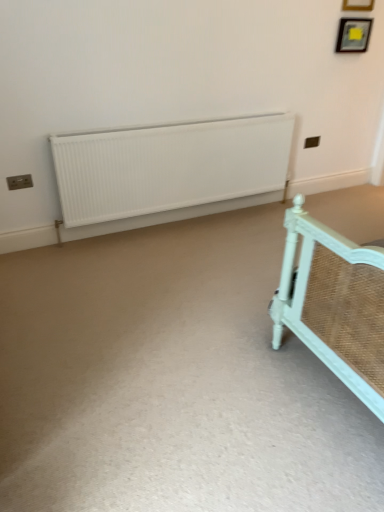
What is the approximate height of white matte radiator at center?

white matte radiator at center is 30.09 inches in height.

Where is `wooden picture frame at upper right, which is the 1th picture frame in bottom-to-top order`? The image size is (384, 512). wooden picture frame at upper right, which is the 1th picture frame in bottom-to-top order is located at coordinates (353, 35).

This screenshot has height=512, width=384. Identify the location of white matte radiator at center. pos(169,166).

Which is closer, (361, 34) or (221, 132)?

The point (221, 132) is closer to the camera.

From a real-world perspective, relative to white matte radiator at center, is wooden picture frame at upper right, acting as the 2th picture frame starting from the top, vertically above or below?

wooden picture frame at upper right, acting as the 2th picture frame starting from the top, is situated higher than white matte radiator at center in the real world.

Does wooden picture frame at upper right, acting as the 2th picture frame starting from the top, have a smaller size compared to white matte radiator at center?

Indeed, wooden picture frame at upper right, acting as the 2th picture frame starting from the top, has a smaller size compared to white matte radiator at center.

Considering the sizes of objects wooden picture frame at upper right, which is the 1th picture frame in bottom-to-top order, and white matte radiator at center in the image provided, who is wider, wooden picture frame at upper right, which is the 1th picture frame in bottom-to-top order, or white matte radiator at center?

Wider between the two is white matte radiator at center.

From the image's perspective, is white matte radiator at center positioned above or below wooden picture frame at upper right, the second picture frame in the bottom-to-top sequence?

Based on their image positions, white matte radiator at center is located beneath wooden picture frame at upper right, the second picture frame in the bottom-to-top sequence.

What's the angular difference between white matte radiator at center and wooden picture frame at upper right, the first picture frame when ordered from top to bottom,'s facing directions?

The angular difference between white matte radiator at center and wooden picture frame at upper right, the first picture frame when ordered from top to bottom, is 0.312 degrees.

Looking at this image, is white matte radiator at center facing towards wooden picture frame at upper right, the first picture frame when ordered from top to bottom?

No, white matte radiator at center is not oriented towards wooden picture frame at upper right, the first picture frame when ordered from top to bottom.

From a real-world perspective, is white matte radiator at center positioned above or below wooden picture frame at upper right, the second picture frame in the bottom-to-top sequence?

From a real-world perspective, white matte radiator at center is physically below wooden picture frame at upper right, the second picture frame in the bottom-to-top sequence.

In terms of width, does wooden picture frame at upper right, the second picture frame in the bottom-to-top sequence, look wider or thinner when compared to white matte radiator at center?

wooden picture frame at upper right, the second picture frame in the bottom-to-top sequence, is thinner than white matte radiator at center.

Is the position of wooden picture frame at upper right, the first picture frame when ordered from top to bottom, less distant than that of white matte radiator at center?

That is False.

Can you tell me how much wooden picture frame at upper right, the second picture frame in the bottom-to-top sequence, and white matte radiator at center differ in facing direction?

wooden picture frame at upper right, the second picture frame in the bottom-to-top sequence, and white matte radiator at center are facing 0.312 degrees away from each other.

Is point (356, 5) positioned before point (191, 128)?

No, (356, 5) is behind (191, 128).

Looking at this image, between white matte radiator at center and wooden picture frame at upper right, which is the 1th picture frame in bottom-to-top order, which one is positioned behind?

wooden picture frame at upper right, which is the 1th picture frame in bottom-to-top order, is more distant.

Which is in front, point (110, 212) or point (351, 44)?

The point (110, 212) is more forward.

Is wooden picture frame at upper right, which is the 1th picture frame in bottom-to-top order, surrounded by white matte radiator at center?

That's incorrect, wooden picture frame at upper right, which is the 1th picture frame in bottom-to-top order, is not inside white matte radiator at center.

In the scene shown: Considering the relative sizes of white matte radiator at center and wooden picture frame at upper right, acting as the 2th picture frame starting from the top, in the image provided, is white matte radiator at center taller than wooden picture frame at upper right, acting as the 2th picture frame starting from the top,?

Indeed, white matte radiator at center has a greater height compared to wooden picture frame at upper right, acting as the 2th picture frame starting from the top.

Is wooden picture frame at upper right, which is the 1th picture frame in bottom-to-top order, turned away from wooden picture frame at upper right, the second picture frame in the bottom-to-top sequence?

No, wooden picture frame at upper right, the second picture frame in the bottom-to-top sequence, is not at the back of wooden picture frame at upper right, which is the 1th picture frame in bottom-to-top order.

Considering the sizes of objects wooden picture frame at upper right, which is the 1th picture frame in bottom-to-top order, and wooden picture frame at upper right, the first picture frame when ordered from top to bottom, in the image provided, who is wider, wooden picture frame at upper right, which is the 1th picture frame in bottom-to-top order, or wooden picture frame at upper right, the first picture frame when ordered from top to bottom,?

wooden picture frame at upper right, which is the 1th picture frame in bottom-to-top order, is wider.

Considering the positions of point (358, 24) and point (354, 6), is point (358, 24) closer or farther from the camera than point (354, 6)?

Point (358, 24).

Based on the photo, in terms of width, does wooden picture frame at upper right, the first picture frame when ordered from top to bottom, look wider or thinner when compared to wooden picture frame at upper right, which is the 1th picture frame in bottom-to-top order?

Clearly, wooden picture frame at upper right, the first picture frame when ordered from top to bottom, has less width compared to wooden picture frame at upper right, which is the 1th picture frame in bottom-to-top order.

Between wooden picture frame at upper right, the first picture frame when ordered from top to bottom, and wooden picture frame at upper right, which is the 1th picture frame in bottom-to-top order, which one appears on the right side from the viewer's perspective?

wooden picture frame at upper right, the first picture frame when ordered from top to bottom, is more to the right.

Considering the relative sizes of wooden picture frame at upper right, the second picture frame in the bottom-to-top sequence, and wooden picture frame at upper right, which is the 1th picture frame in bottom-to-top order, in the image provided, is wooden picture frame at upper right, the second picture frame in the bottom-to-top sequence, taller than wooden picture frame at upper right, which is the 1th picture frame in bottom-to-top order,?

Yes.

From a real-world perspective, which object stands above the other?

From a 3D spatial view, wooden picture frame at upper right, the first picture frame when ordered from top to bottom, is above.

This screenshot has height=512, width=384. Find the location of `the 1st picture frame directly above the white matte radiator at center (from a real-world perspective)`. the 1st picture frame directly above the white matte radiator at center (from a real-world perspective) is located at coordinates (353, 35).

You are a GUI agent. You are given a task and a screenshot of the screen. Output one action in this format:
    pyautogui.click(x=<x>, y=<y>)
    Task: Click on the radiator in front of the wooden picture frame at upper right, the first picture frame when ordered from top to bottom
    The height and width of the screenshot is (512, 384).
    Given the screenshot: What is the action you would take?
    pyautogui.click(x=169, y=166)

Estimate the real-world distances between objects in this image. Which object is further from wooden picture frame at upper right, the second picture frame in the bottom-to-top sequence, wooden picture frame at upper right, which is the 1th picture frame in bottom-to-top order, or white matte radiator at center?

Among the two, white matte radiator at center is located further to wooden picture frame at upper right, the second picture frame in the bottom-to-top sequence.

When comparing their distances from white matte radiator at center, does wooden picture frame at upper right, which is the 1th picture frame in bottom-to-top order, or wooden picture frame at upper right, the first picture frame when ordered from top to bottom, seem closer?

wooden picture frame at upper right, which is the 1th picture frame in bottom-to-top order, lies closer to white matte radiator at center than the other object.

When comparing their distances from white matte radiator at center, does wooden picture frame at upper right, the first picture frame when ordered from top to bottom, or wooden picture frame at upper right, which is the 1th picture frame in bottom-to-top order, seem further?

wooden picture frame at upper right, the first picture frame when ordered from top to bottom, is positioned further to the anchor white matte radiator at center.

Based on their spatial positions, is wooden picture frame at upper right, the first picture frame when ordered from top to bottom, or white matte radiator at center further from wooden picture frame at upper right, acting as the 2th picture frame starting from the top?

white matte radiator at center is further to wooden picture frame at upper right, acting as the 2th picture frame starting from the top.

Consider the image. Estimate the real-world distances between objects in this image. Which object is closer to wooden picture frame at upper right, acting as the 2th picture frame starting from the top, white matte radiator at center or wooden picture frame at upper right, the first picture frame when ordered from top to bottom?

The object closer to wooden picture frame at upper right, acting as the 2th picture frame starting from the top, is wooden picture frame at upper right, the first picture frame when ordered from top to bottom.

Considering their positions, is white matte radiator at center positioned further to wooden picture frame at upper right, the second picture frame in the bottom-to-top sequence, than wooden picture frame at upper right, acting as the 2th picture frame starting from the top?

white matte radiator at center is further to wooden picture frame at upper right, the second picture frame in the bottom-to-top sequence.

This screenshot has height=512, width=384. What are the coordinates of `picture frame between white matte radiator at center and wooden picture frame at upper right, the first picture frame when ordered from top to bottom, from left to right` in the screenshot? It's located at (353, 35).